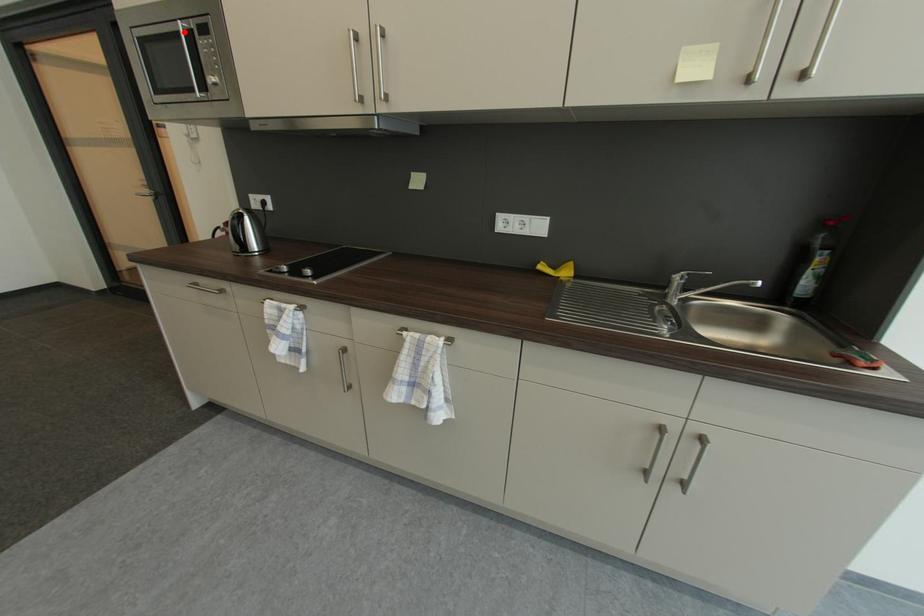
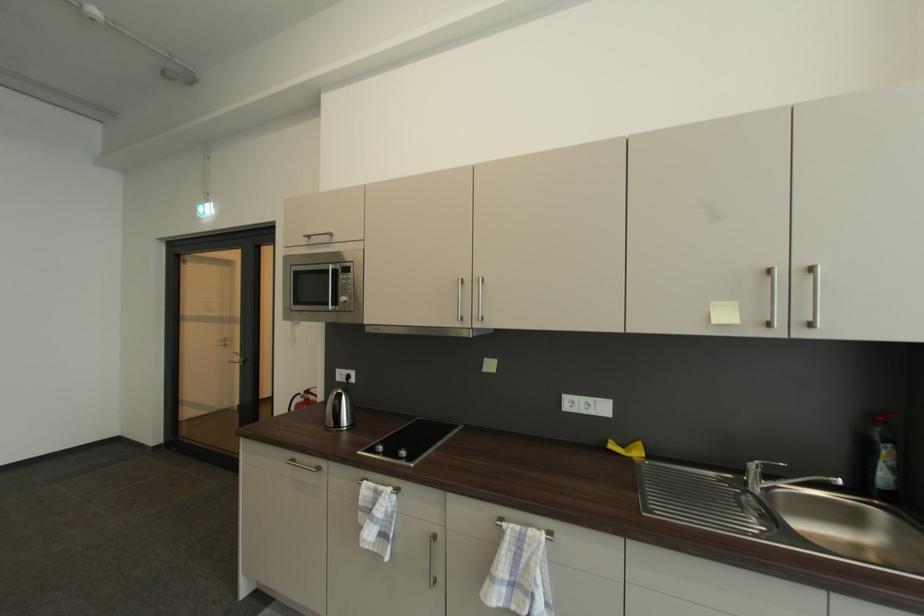
Question: A red point is marked in image1. In image2, is the corresponding 3D point closer to the camera or farther? Reply with the corresponding letter.

Choices:
 (A) The corresponding 3D point is closer.
 (B) The corresponding 3D point is farther.

Answer: (A)